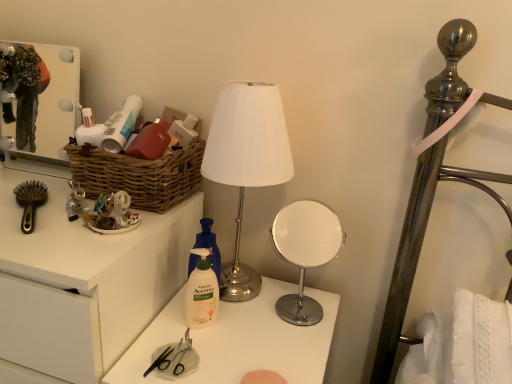
This screenshot has width=512, height=384. I want to click on free space to the left of white matte lotion at center, marked as the first toiletry in a right-to-left arrangement, so click(161, 331).